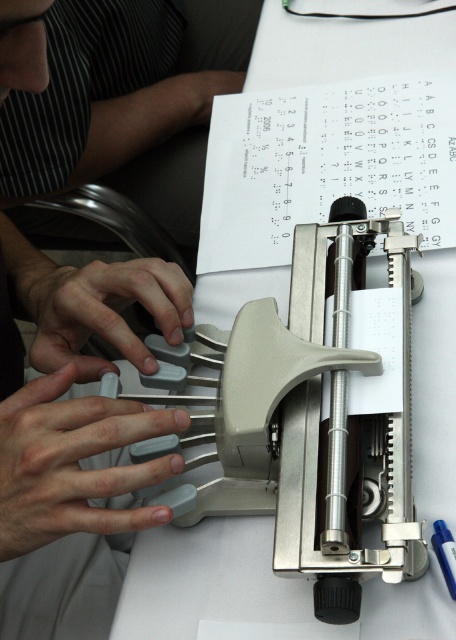
At what (x,y) coordinates should I click in order to perform the action: click on gray rubberized keys at center. Please return your answer as a coordinate pair (x, y). This screenshot has height=640, width=456. Looking at the image, I should click on (73, 461).

Does gray rubberized keys at center have a lesser width compared to gray rubber keys at center?

Yes, gray rubberized keys at center is thinner than gray rubber keys at center.

Image resolution: width=456 pixels, height=640 pixels. What do you see at coordinates (73, 461) in the screenshot?
I see `gray rubberized keys at center` at bounding box center [73, 461].

At what (x,y) coordinates should I click in order to perform the action: click on gray rubberized keys at center. Please return your answer as a coordinate pair (x, y). This screenshot has height=640, width=456. Looking at the image, I should click on (73, 461).